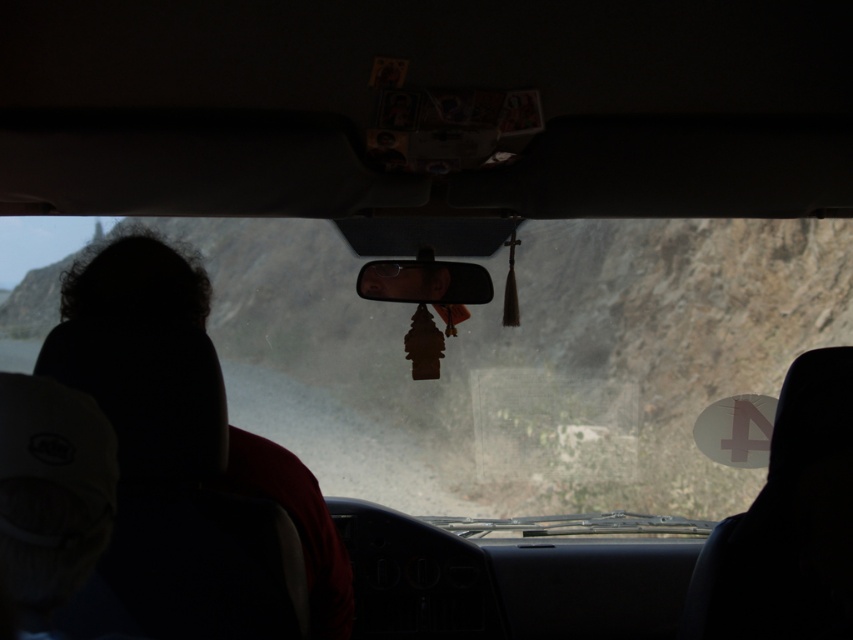
You are driving a car and see the point at coordinates [395,435] through the windshield. If your car is 4.5 meters long, can you safely back up to that point without hitting the rear bumper?

The point at coordinates [395,435] is 8.75 meters away from the viewer. Since the car is 4.5 meters long, backing up would require at least 4.5 meters of space. Since 8.75 meters is more than 4.5 meters, you can safely back up to that point without hitting the rear bumper.

You are a passenger in the car and want to see the road ahead. Which object, the transparent glass windshield at center or the dark hair at left, provides a clearer view of the outside environment?

The transparent glass windshield at center provides a clearer view of the outside environment because it is made of transparent glass, unlike the dark hair at left which blocks the view.

You are a passenger in the car and want to point out an object outside using coordinates. The driver asks you to describe what you see at point (183, 397). What do you tell them?

At point (183, 397), there is dark hair at left.